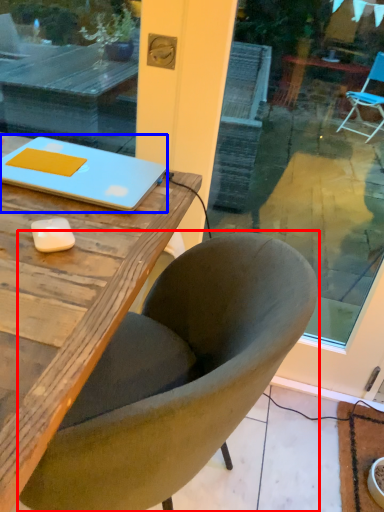
Question: Which object is further to the camera taking this photo, chair (highlighted by a red box) or laptop (highlighted by a blue box)?

Choices:
 (A) chair
 (B) laptop

Answer: (B)